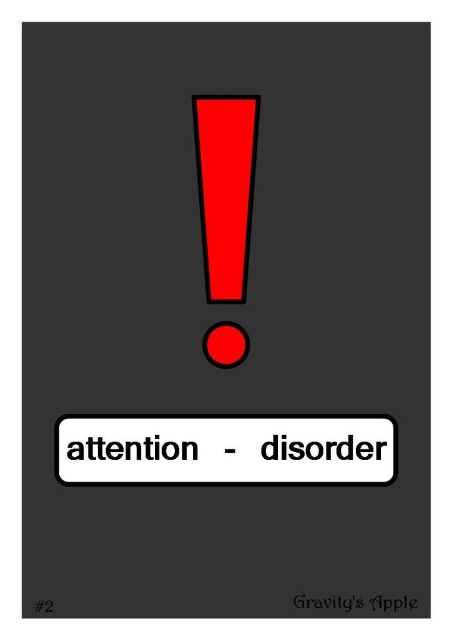
You are designing a poster and want to ensure proper spacing between the white matte rectangle at center and the matte black circle at center. Which object has a larger width, requiring more horizontal space?

The white matte rectangle at center has a larger width than the matte black circle at center, so it requires more horizontal space.

You are an interior designer arranging furniture in a room. You have a white matte rectangle at center and a matte black circle at center. According to the image, which object is positioned to the left?

The matte black circle at center is positioned to the left of the white matte rectangle at center.